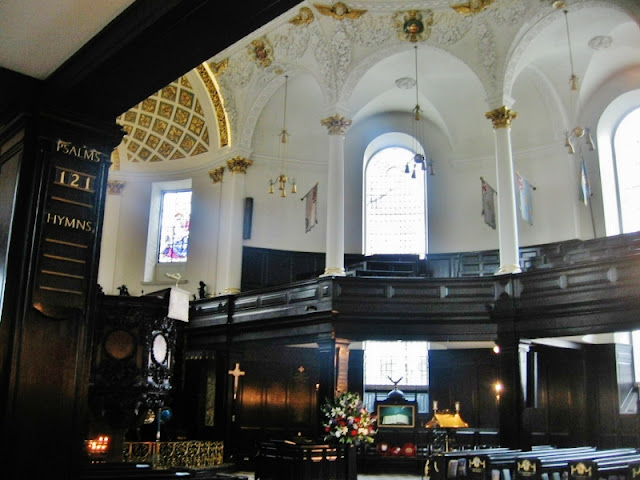
Locate an element on the screen. stained glass window is located at coordinates (175, 227).